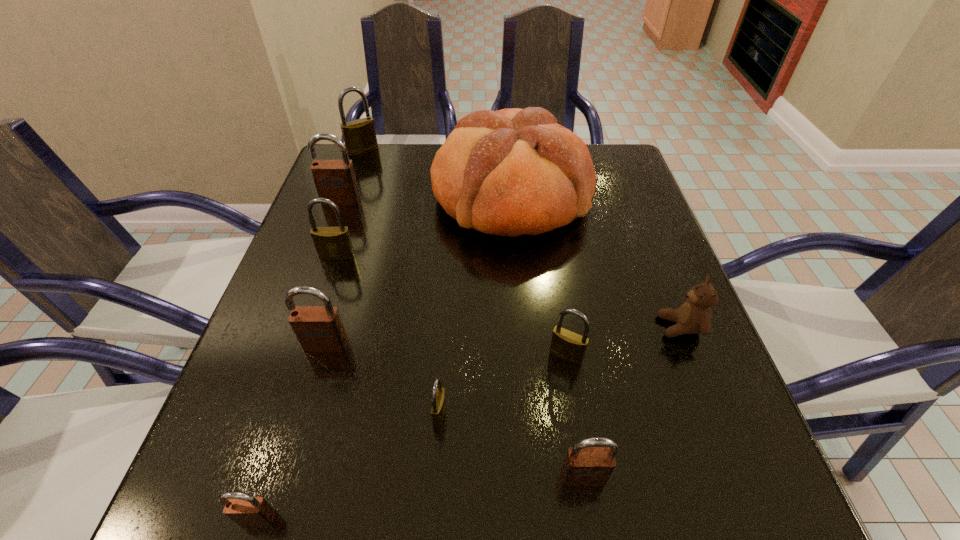
At what (x,y) coordinates should I click in order to perform the action: click on padlock that stands as the closest to the seventh nearest padlock. Please return your answer as a coordinate pair (x, y). The image size is (960, 540). Looking at the image, I should click on (332, 243).

The width and height of the screenshot is (960, 540). I want to click on the third closest brass padlock to the second biggest brass padlock, so click(565, 344).

Choose which brass padlock is the third nearest neighbor to the sixth nearest padlock. Please provide its 2D coordinates. Your answer should be formatted as a tuple, i.e. [(x, y)], where the tuple contains the x and y coordinates of a point satisfying the conditions above.

[(565, 344)]

Select which brown padlock is the fourth closest to the bread. Please provide its 2D coordinates. Your answer should be formatted as a tuple, i.e. [(x, y)], where the tuple contains the x and y coordinates of a point satisfying the conditions above.

[(244, 509)]

Identify which brown padlock is the second closest to the second biggest brown padlock. Please provide its 2D coordinates. Your answer should be formatted as a tuple, i.e. [(x, y)], where the tuple contains the x and y coordinates of a point satisfying the conditions above.

[(335, 180)]

Where is `vacant area in the image that satisfies the following two spatial constraints: 1. at the face of the teddy bear; 2. on the front side of the third nearest object`? The height and width of the screenshot is (540, 960). vacant area in the image that satisfies the following two spatial constraints: 1. at the face of the teddy bear; 2. on the front side of the third nearest object is located at coordinates (715, 414).

Identify the location of vacant space that satisfies the following two spatial constraints: 1. on the front-facing side of the biggest brown padlock; 2. on the right side of the third nearest padlock. (263, 414).

What are the coordinates of `vacant space that satisfies the following two spatial constraints: 1. on the front-facing side of the rightmost brass padlock; 2. on the right side of the seventh nearest padlock` in the screenshot? It's located at (285, 355).